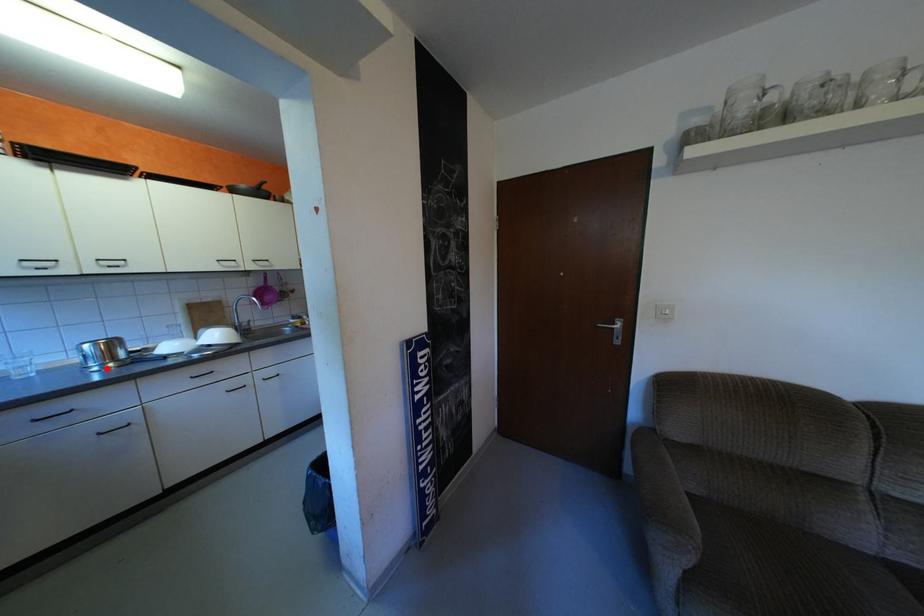
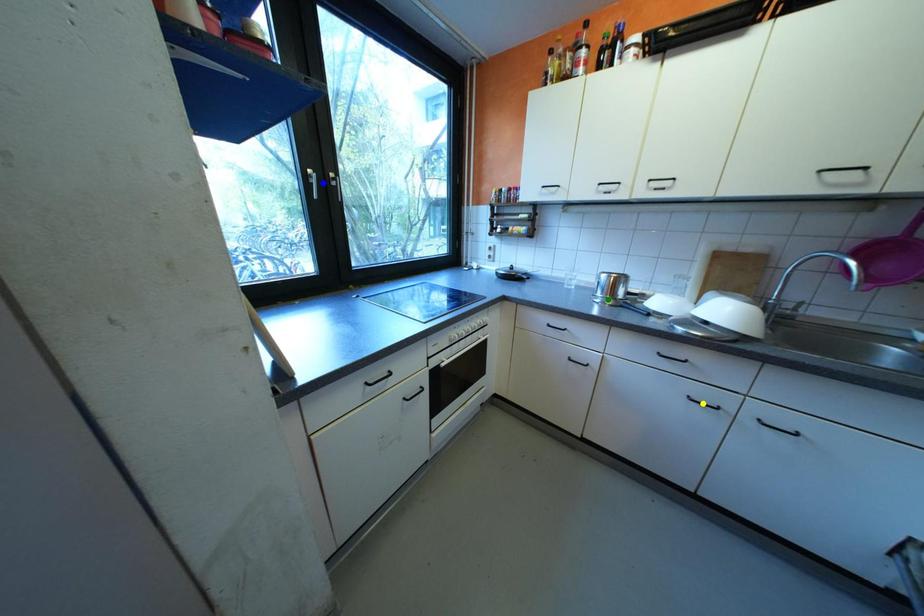
Question: I am providing you with two images of the same scene from different viewpoints. A red point is marked on the first image. You are given multiple points on the second image. Which spot in image 2 lines up with the point in image 1?

Choices:
 (A) blue point
 (B) green point
 (C) yellow point

Answer: (B)